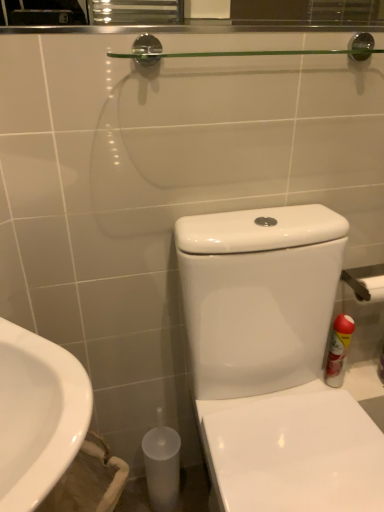
Question: Would you say metallic silver towel bar at right is outside white glossy toilet at center?

Choices:
 (A) no
 (B) yes

Answer: (B)

Question: Is metallic silver towel bar at right not close to white glossy toilet at center?

Choices:
 (A) yes
 (B) no

Answer: (B)

Question: Is metallic silver towel bar at right aimed at white glossy toilet at center?

Choices:
 (A) no
 (B) yes

Answer: (A)

Question: From a real-world perspective, is metallic silver towel bar at right on top of white glossy toilet at center?

Choices:
 (A) yes
 (B) no

Answer: (A)

Question: Can you confirm if metallic silver towel bar at right is positioned to the left of white glossy toilet at center?

Choices:
 (A) yes
 (B) no

Answer: (B)

Question: Is point (28, 417) positioned closer to the camera than point (337, 364)?

Choices:
 (A) closer
 (B) farther

Answer: (A)

Question: Is white glossy sink at lower left inside the boundaries of red matte spray can at right, or outside?

Choices:
 (A) outside
 (B) inside

Answer: (A)

Question: Looking at their shapes, would you say white glossy sink at lower left is wider or thinner than red matte spray can at right?

Choices:
 (A) wide
 (B) thin

Answer: (A)

Question: Based on their positions, is white glossy sink at lower left located to the left or right of red matte spray can at right?

Choices:
 (A) left
 (B) right

Answer: (A)

Question: Considering the positions of white glossy toilet at center and red matte spray can at right in the image, is white glossy toilet at center wider or thinner than red matte spray can at right?

Choices:
 (A) thin
 (B) wide

Answer: (B)

Question: From a real-world perspective, is white glossy toilet at center physically located above or below red matte spray can at right?

Choices:
 (A) below
 (B) above

Answer: (B)

Question: Would you say white glossy toilet at center is inside or outside red matte spray can at right?

Choices:
 (A) outside
 (B) inside

Answer: (A)

Question: Would you say white glossy toilet at center is to the left or to the right of red matte spray can at right in the picture?

Choices:
 (A) left
 (B) right

Answer: (A)

Question: Relative to white glossy toilet at center, is metallic silver towel bar at right in front or behind?

Choices:
 (A) front
 (B) behind

Answer: (B)

Question: Considering the positions of point (375, 268) and point (271, 212), is point (375, 268) closer or farther from the camera than point (271, 212)?

Choices:
 (A) closer
 (B) farther

Answer: (B)